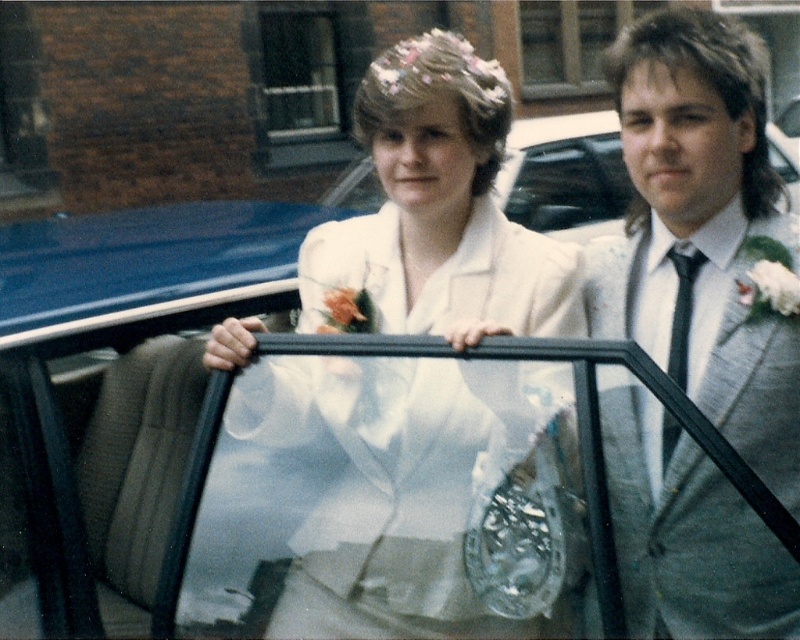
Question: Does white satin dress at center appear under gray suit at right?

Choices:
 (A) yes
 (B) no

Answer: (B)

Question: Which of the following is the closest to the observer?

Choices:
 (A) (678, 595)
 (B) (432, 486)

Answer: (B)

Question: From the image, what is the correct spatial relationship of white satin dress at center in relation to gray suit at right?

Choices:
 (A) right
 (B) left

Answer: (B)

Question: Can you confirm if white satin dress at center is wider than gray suit at right?

Choices:
 (A) yes
 (B) no

Answer: (A)

Question: Which object appears closest to the camera in this image?

Choices:
 (A) gray suit at right
 (B) white satin dress at center

Answer: (A)